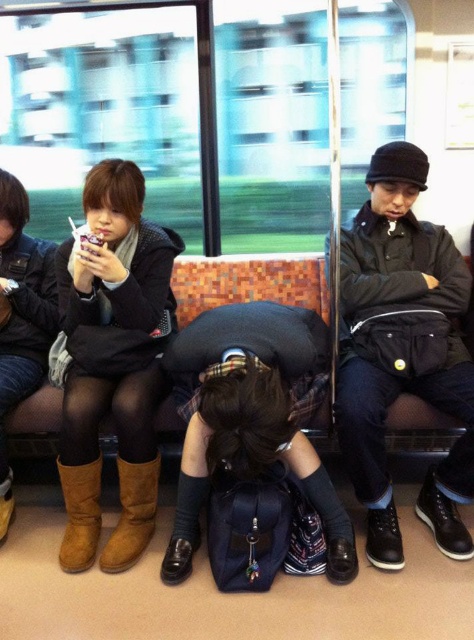
Question: Which point is closer to the camera?

Choices:
 (A) (98, 486)
 (B) (429, 333)
 (C) (60, 474)
 (D) (137, 492)

Answer: (D)

Question: Is brown suede boot at lower center to the right of brown suede boot at lower left from the viewer's perspective?

Choices:
 (A) yes
 (B) no

Answer: (A)

Question: Which of the following is the closest to the observer?

Choices:
 (A) (117, 568)
 (B) (72, 470)

Answer: (A)

Question: Can you confirm if brown suede boots at left is wider than brown suede boot at lower left?

Choices:
 (A) yes
 (B) no

Answer: (A)

Question: Is brown suede boots at left further to the viewer compared to brown suede boot at lower center?

Choices:
 (A) yes
 (B) no

Answer: (A)

Question: Which object is farther from the camera taking this photo?

Choices:
 (A) brown suede boot at lower center
 (B) brown suede boots at left
 (C) brown suede boot at lower left
 (D) black leather jacket at upper right

Answer: (C)